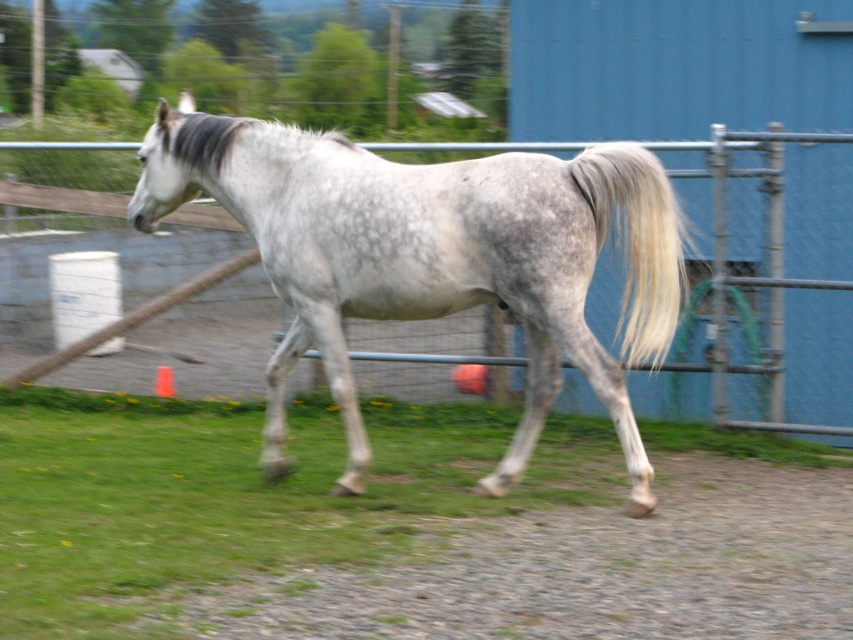
Does gray speckled horse at center appear over gray silky tail at right?

No, gray speckled horse at center is not above gray silky tail at right.

Can you confirm if gray speckled horse at center is thinner than gray silky tail at right?

No.

Does point (630, 253) lie behind point (650, 156)?

That is False.

Where is `gray speckled horse at center`? This screenshot has height=640, width=853. gray speckled horse at center is located at coordinates (430, 257).

Between point (323, 465) and point (579, 298), which one is positioned in front?

Point (579, 298)

Looking at this image, who is more forward, (x=117, y=452) or (x=657, y=252)?

Positioned in front is point (x=657, y=252).

The width and height of the screenshot is (853, 640). In order to click on green grass at lower center in this screenshot , I will do `click(235, 496)`.

Is green grass at lower center further to the viewer compared to gray silky tail at right?

Yes, green grass at lower center is further from the viewer.

Can you confirm if green grass at lower center is positioned to the left of gray silky tail at right?

Indeed, green grass at lower center is positioned on the left side of gray silky tail at right.

Measure the distance between green grass at lower center and camera.

green grass at lower center and camera are 7.12 meters apart.

At what (x,y) coordinates should I click in order to perform the action: click on green grass at lower center. Please return your answer as a coordinate pair (x, y). The image size is (853, 640). Looking at the image, I should click on (235, 496).